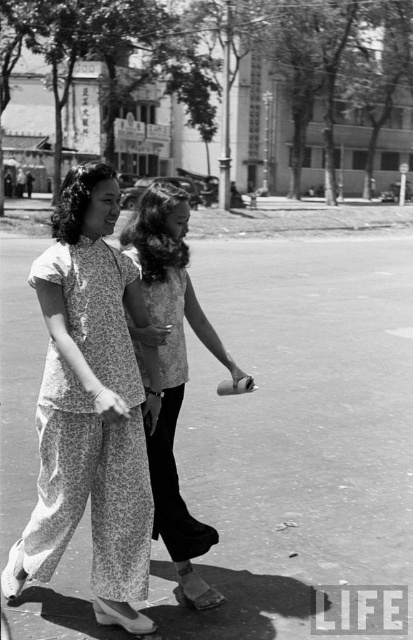
You are a photographer reviewing this black and white photo. You notice two points marked in the image. The first point is at coordinates point (116, 189) and the second is at point (189, 323). Based on their positions, which point is closer to the camera?

Point (116, 189) is closer to the camera than point (189, 323).

You are a photographer who wants to capture a closeup shot of both the printed cotton dress at center and the floral fabric dress at center in the scene. Given that your camera has a 36 inch lens, will you be able to focus on both dresses simultaneously?

The printed cotton dress at center is 36.80 inches away from the floral fabric dress at center. Since the distance between them is greater than 36 inches, the camera lens cannot focus on both dresses at the same time.

Both women are wearing dresses. The printed cotton dress at center and the floral fabric dress at center. Which dress is bigger?

The printed cotton dress at center is larger in size than the floral fabric dress at center.